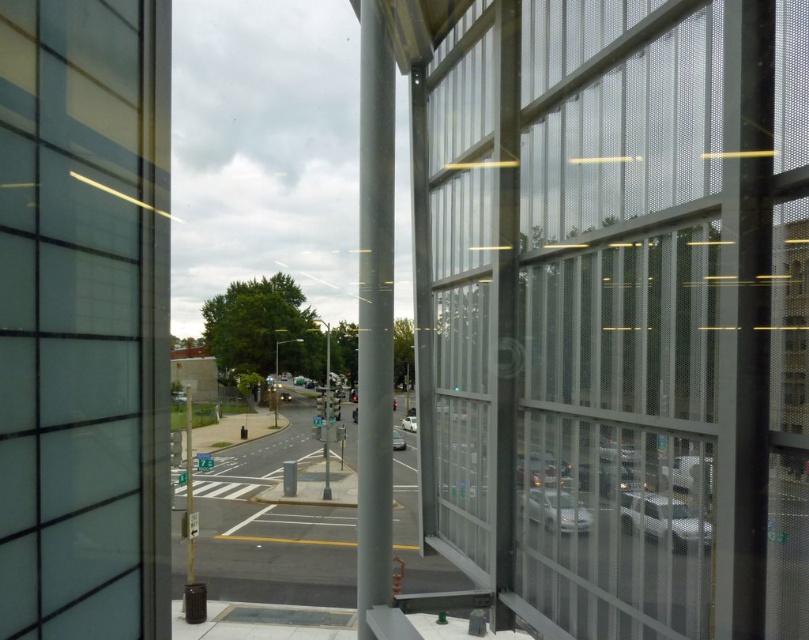
Question: Does satin silver pole at center appear on the right side of white matte car at center?

Choices:
 (A) no
 (B) yes

Answer: (A)

Question: Which of the following is the closest to the observer?

Choices:
 (A) (566, 465)
 (B) (371, 525)
 (C) (627, 493)

Answer: (C)

Question: Which of the following is the closest to the observer?

Choices:
 (A) (397, 433)
 (B) (663, 474)
 (C) (702, 525)
 (D) (286, 392)

Answer: (C)

Question: Can you confirm if silver metallic car at lower right is positioned below metallic silver sedan at center?

Choices:
 (A) yes
 (B) no

Answer: (A)

Question: Is satin silver pole at center positioned behind white matte car at center?

Choices:
 (A) yes
 (B) no

Answer: (B)

Question: Which point appears closest to the camera in this image?

Choices:
 (A) (672, 529)
 (B) (405, 416)
 (C) (540, 481)
 (D) (284, 401)

Answer: (A)